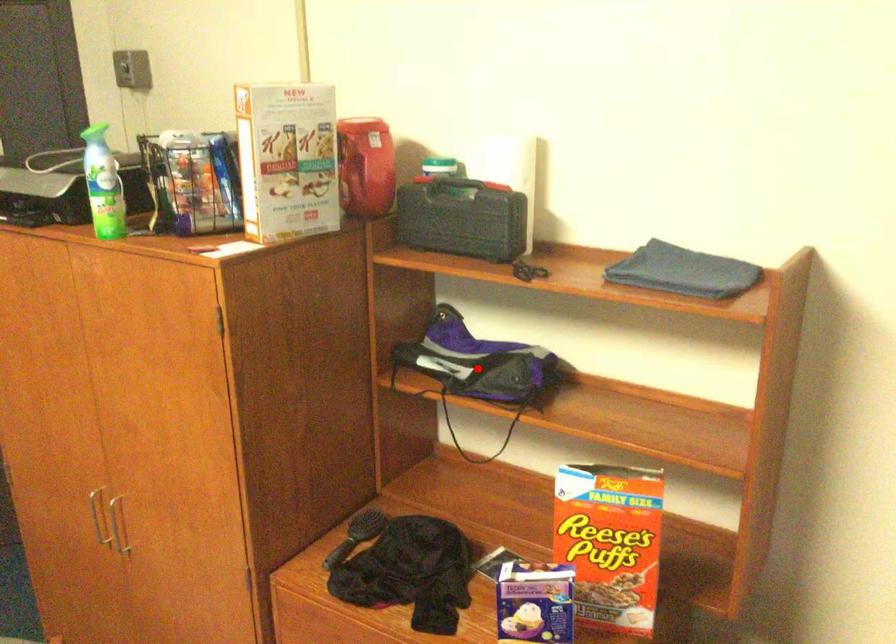
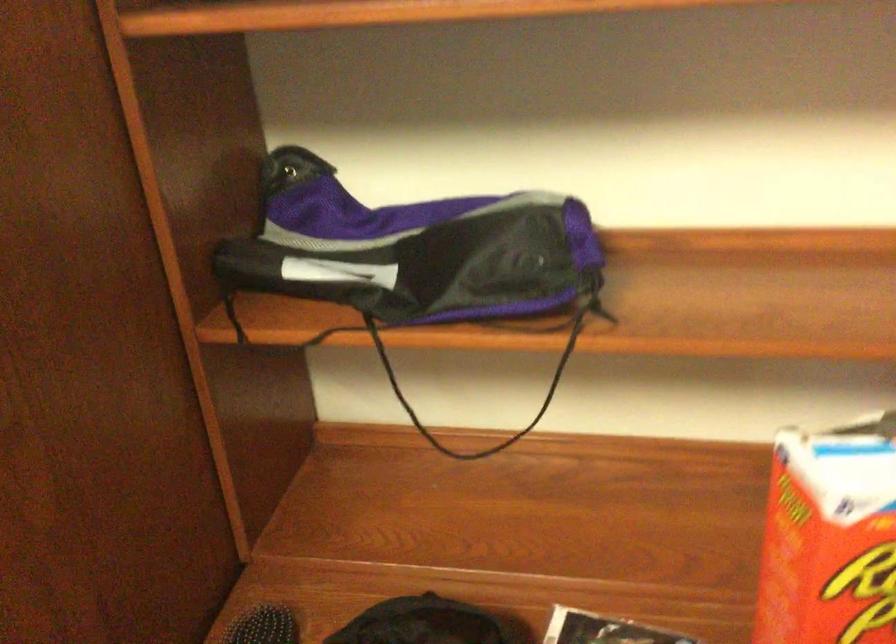
Find the pixel in the second image that matches the highlighted location in the first image.

(415, 259)